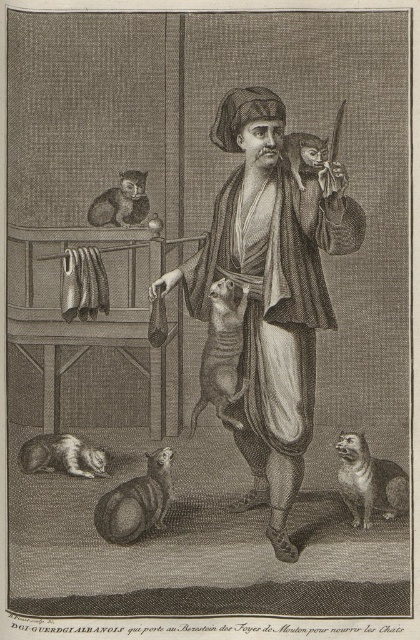
Question: Does striped fur cat at center have a larger size compared to fluffy brown cat at lower center?

Choices:
 (A) no
 (B) yes

Answer: (B)

Question: Which object appears farthest from the camera in this image?

Choices:
 (A) fluffy brown cat at lower right
 (B) fluffy brown cat at upper center

Answer: (A)

Question: Is brown leather bag at center bigger than fluffy brown cat at center?

Choices:
 (A) yes
 (B) no

Answer: (A)

Question: Among these points, which one is nearest to the camera?

Choices:
 (A) (220, 365)
 (B) (361, 468)

Answer: (A)

Question: Which object is farther from the camera taking this photo?

Choices:
 (A) striped fur cat at center
 (B) brown leather bag at center
 (C) fluffy brown cat at upper center

Answer: (A)

Question: Is brown leather bag at center wider than fluffy brown cat at center?

Choices:
 (A) yes
 (B) no

Answer: (A)